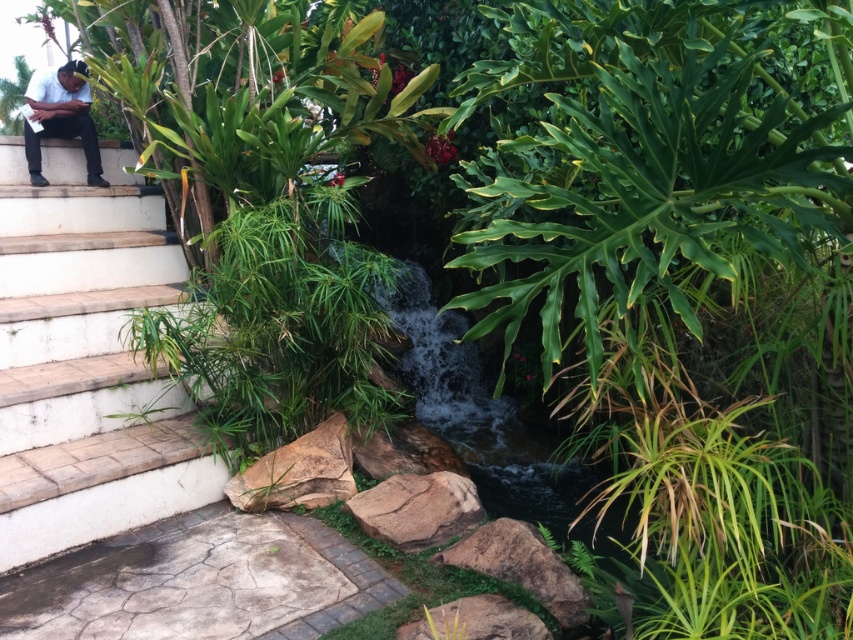
Question: Is white stone stairs at left positioned in front of black matte clothing at left?

Choices:
 (A) yes
 (B) no

Answer: (A)

Question: Which point appears farthest from the camera in this image?

Choices:
 (A) (51, 93)
 (B) (212, 477)

Answer: (A)

Question: Is white stone stairs at left bigger than black matte clothing at left?

Choices:
 (A) yes
 (B) no

Answer: (A)

Question: Considering the relative positions of white stone stairs at left and black matte clothing at left in the image provided, where is white stone stairs at left located with respect to black matte clothing at left?

Choices:
 (A) left
 (B) right

Answer: (B)

Question: Which point is closer to the camera?

Choices:
 (A) white stone stairs at left
 (B) black matte clothing at left

Answer: (A)